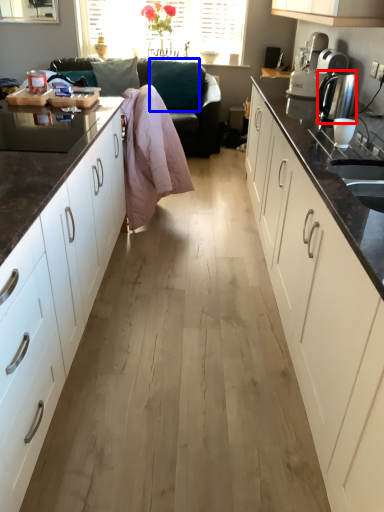
Question: Which object is further to the camera taking this photo, kitchen appliance (highlighted by a red box) or pillow (highlighted by a blue box)?

Choices:
 (A) kitchen appliance
 (B) pillow

Answer: (B)